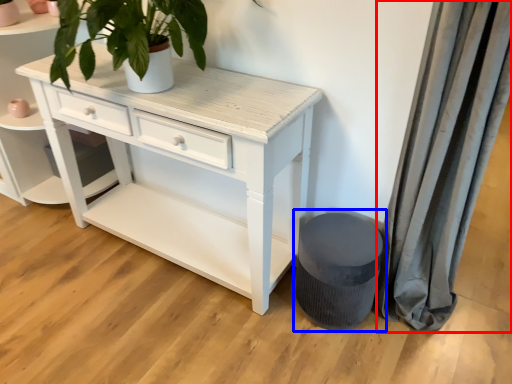
Question: Which of the following is the closest to the observer, curtain (highlighted by a red box) or music stool (highlighted by a blue box)?

Choices:
 (A) curtain
 (B) music stool

Answer: (A)